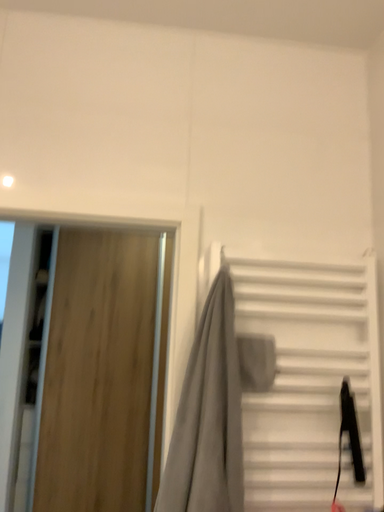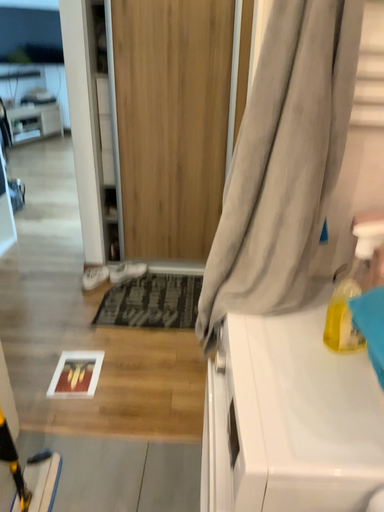
Question: Which way did the camera rotate in the video?

Choices:
 (A) rotated downward
 (B) rotated upward

Answer: (A)